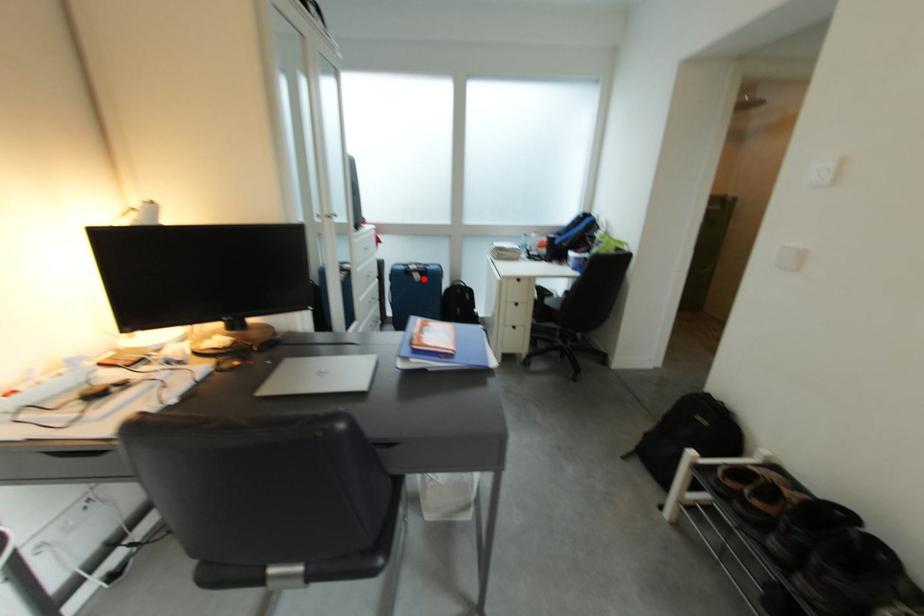
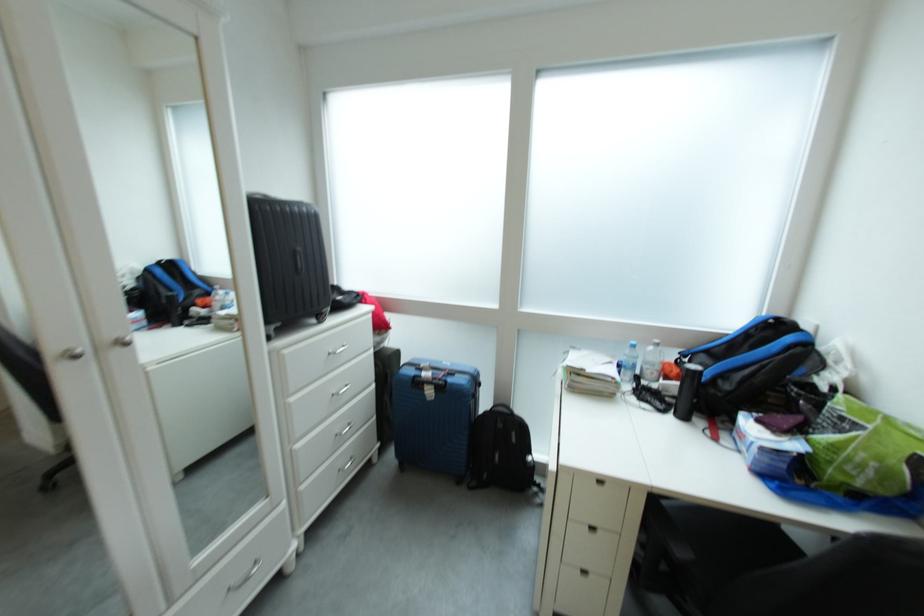
Question: I am providing you with two images of the same scene from different viewpoints. Given a red point in image1, look at the same physical point in image2. Is it:

Choices:
 (A) Closer to the viewpoint
 (B) Farther from the viewpoint

Answer: (B)